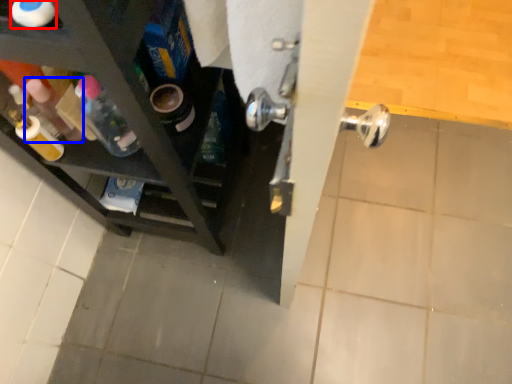
Question: Which point is further to the camera, bottle (highlighted by a red box) or bottle (highlighted by a blue box)?

Choices:
 (A) bottle
 (B) bottle

Answer: (B)